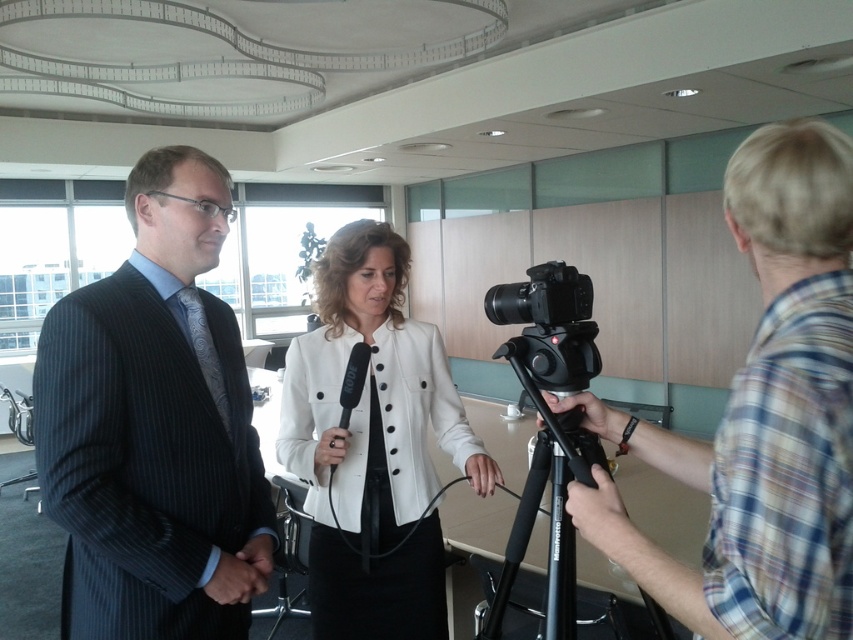
You are a photographer in a professional setting. You need to position a camera on the black rubber tripod at lower right to capture the dark pinstripe suit at left. What is the minimum distance you need to extend the tripod legs to ensure the camera can reach the subject?

The dark pinstripe suit at left is 24.27 inches from the black rubber tripod at lower right. To capture the subject, the tripod legs must be extended at least 24.27 inches to ensure the camera can reach the dark pinstripe suit at left.

You are a photographer in the scene who wants to ensure all subjects are in frame. Given the dark pinstripe suit at left and the black plastic camera at center, which object should you focus on first to capture both in the shot?

The dark pinstripe suit at left is larger in size compared to the black plastic camera at center, so focusing on the dark pinstripe suit at left first will ensure it is properly framed before adjusting for the smaller camera.

You are a camera operator setting up for the interview. You need to focus on two specific points in the scene. The first point is at coordinate point(305, 500) and the second point is at point(567, 460). Which point is closer to the camera?

Point(305, 500) is closer to the camera than point(567, 460).